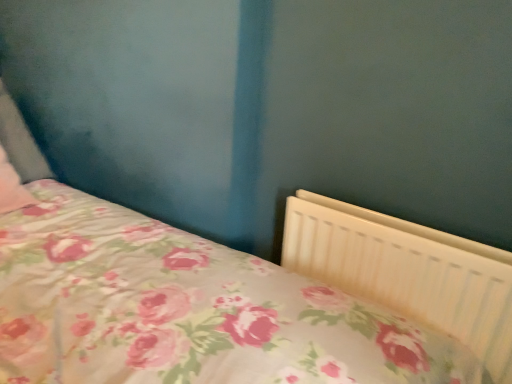
Question: Is white plastic radiator at lower right thinner than pink floral fabric pillow at left?

Choices:
 (A) no
 (B) yes

Answer: (B)

Question: Is white plastic radiator at lower right oriented away from pink floral fabric pillow at left?

Choices:
 (A) yes
 (B) no

Answer: (B)

Question: From the image's perspective, is white plastic radiator at lower right under pink floral fabric pillow at left?

Choices:
 (A) no
 (B) yes

Answer: (B)

Question: Is the position of white plastic radiator at lower right more distant than that of pink floral fabric pillow at left?

Choices:
 (A) no
 (B) yes

Answer: (A)

Question: Is white plastic radiator at lower right placed right next to pink floral fabric pillow at left?

Choices:
 (A) no
 (B) yes

Answer: (A)

Question: From a real-world perspective, is white plastic radiator at lower right positioned under pink floral fabric pillow at left based on gravity?

Choices:
 (A) yes
 (B) no

Answer: (A)

Question: Is pink floral fabric pillow at left positioned beyond the bounds of white plastic radiator at lower right?

Choices:
 (A) yes
 (B) no

Answer: (A)

Question: From the image's perspective, is pink floral fabric pillow at left on white plastic radiator at lower right?

Choices:
 (A) yes
 (B) no

Answer: (A)

Question: Can you confirm if pink floral fabric pillow at left is taller than white plastic radiator at lower right?

Choices:
 (A) no
 (B) yes

Answer: (A)

Question: Does pink floral fabric pillow at left have a lesser width compared to white plastic radiator at lower right?

Choices:
 (A) yes
 (B) no

Answer: (B)

Question: Is white plastic radiator at lower right completely or partially inside pink floral fabric pillow at left?

Choices:
 (A) no
 (B) yes

Answer: (A)

Question: Is pink floral fabric pillow at left oriented away from white plastic radiator at lower right?

Choices:
 (A) yes
 (B) no

Answer: (B)

Question: Relative to pink floral fabric pillow at left, is white plastic radiator at lower right in front or behind?

Choices:
 (A) front
 (B) behind

Answer: (A)